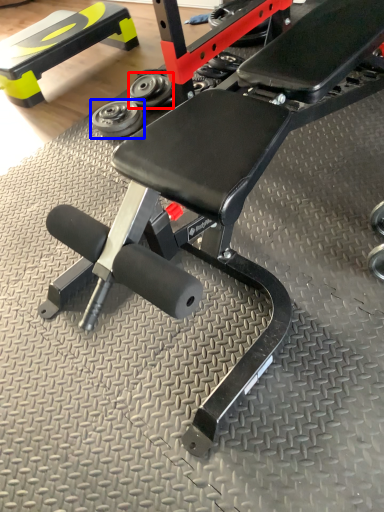
Question: Which of the following is the farthest to the observer, dumbbell (highlighted by a red box) or dumbbell (highlighted by a blue box)?

Choices:
 (A) dumbbell
 (B) dumbbell

Answer: (A)